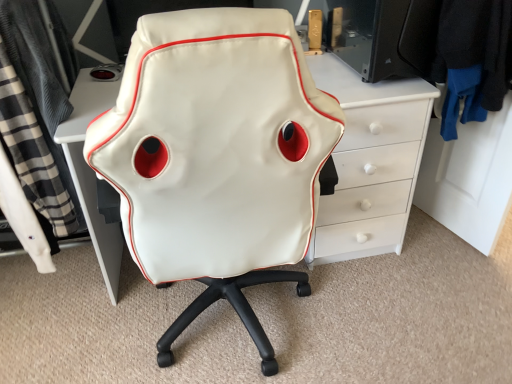
Question: Is white leather chair at center wider than black plaid fabric at left, the 2th clothing viewed from the right?

Choices:
 (A) yes
 (B) no

Answer: (A)

Question: From a real-world perspective, is white leather chair at center positioned under black plaid fabric at left, the 2th clothing viewed from the right, based on gravity?

Choices:
 (A) no
 (B) yes

Answer: (B)

Question: Is white leather chair at center oriented towards black plaid fabric at left, the 2th clothing viewed from the right?

Choices:
 (A) no
 (B) yes

Answer: (A)

Question: Is white leather chair at center oriented away from black plaid fabric at left, the 2th clothing viewed from the right?

Choices:
 (A) yes
 (B) no

Answer: (B)

Question: Considering the relative positions of white leather chair at center and black plaid fabric at left, the 2th clothing viewed from the right, in the image provided, is white leather chair at center behind black plaid fabric at left, the 2th clothing viewed from the right,?

Choices:
 (A) no
 (B) yes

Answer: (A)

Question: From a real-world perspective, is black fabric jacket at upper right, the 2th clothing when ordered from left to right, above or below white leather chair at center?

Choices:
 (A) below
 (B) above

Answer: (B)

Question: In the image, is black fabric jacket at upper right, which is the 1th clothing from right to left, positioned in front of or behind white leather chair at center?

Choices:
 (A) front
 (B) behind

Answer: (B)

Question: Considering the positions of black fabric jacket at upper right, which is the 1th clothing from right to left, and white leather chair at center in the image, is black fabric jacket at upper right, which is the 1th clothing from right to left, bigger or smaller than white leather chair at center?

Choices:
 (A) small
 (B) big

Answer: (A)

Question: From the image's perspective, relative to white leather chair at center, is black fabric jacket at upper right, the 2th clothing when ordered from left to right, above or below?

Choices:
 (A) below
 (B) above

Answer: (B)

Question: In terms of size, does white leather chair at center appear bigger or smaller than black plaid fabric at left, the 2th clothing viewed from the right?

Choices:
 (A) big
 (B) small

Answer: (A)

Question: In terms of width, does white leather chair at center look wider or thinner when compared to black plaid fabric at left, which appears as the 1th clothing when viewed from the left?

Choices:
 (A) thin
 (B) wide

Answer: (B)

Question: Choose the correct answer: Is white leather chair at center inside black plaid fabric at left, which appears as the 1th clothing when viewed from the left, or outside it?

Choices:
 (A) inside
 (B) outside

Answer: (B)

Question: In the image, is white leather chair at center positioned in front of or behind black plaid fabric at left, the 2th clothing viewed from the right?

Choices:
 (A) behind
 (B) front

Answer: (B)

Question: Based on their sizes in the image, would you say black plaid fabric at left, the 2th clothing viewed from the right, is bigger or smaller than black fabric jacket at upper right, which is the 1th clothing from right to left?

Choices:
 (A) big
 (B) small

Answer: (A)

Question: In the image, is black plaid fabric at left, which appears as the 1th clothing when viewed from the left, positioned in front of or behind black fabric jacket at upper right, the 2th clothing when ordered from left to right?

Choices:
 (A) behind
 (B) front

Answer: (B)